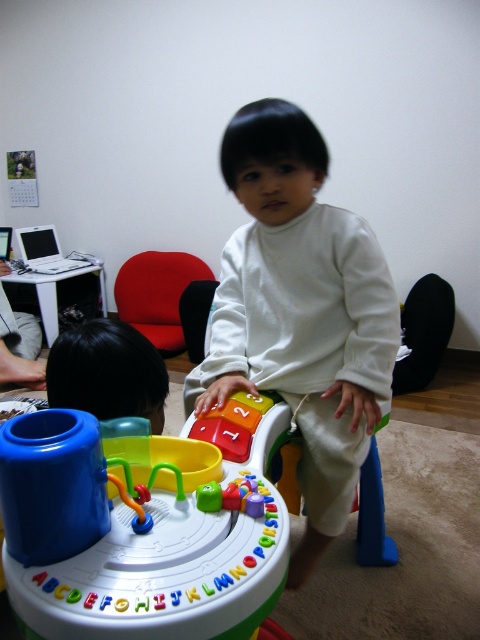
Is white matte toddler at center below white plastic walker at center?

No, white matte toddler at center is not below white plastic walker at center.

Is the position of white matte toddler at center less distant than that of white plastic walker at center?

No, white matte toddler at center is further to the viewer.

Who is more forward, [294,554] or [72,620]?

Positioned in front is point [72,620].

This screenshot has height=640, width=480. I want to click on white matte toddler at center, so click(300, 312).

Based on the photo, is white matte toddler at center positioned at the back of rubberized plastic number blocks at center?

Yes, white matte toddler at center is further from the viewer.

Does white matte toddler at center have a greater height compared to rubberized plastic number blocks at center?

Indeed, white matte toddler at center has a greater height compared to rubberized plastic number blocks at center.

Identify the location of white matte toddler at center. (300, 312).

Is white plastic walker at center wider than black hair at upper left?

Correct, the width of white plastic walker at center exceeds that of black hair at upper left.

Who is more distant from viewer, (108, 556) or (140, 404)?

The point (140, 404) is more distant.

Between point (47, 598) and point (123, 378), which one is positioned behind?

Positioned behind is point (123, 378).

You are a GUI agent. You are given a task and a screenshot of the screen. Output one action in this format:
    pyautogui.click(x=<x>, y=<y>)
    Task: Click on the white plastic walker at center
    This screenshot has height=640, width=480.
    Given the screenshot: What is the action you would take?
    pyautogui.click(x=168, y=557)